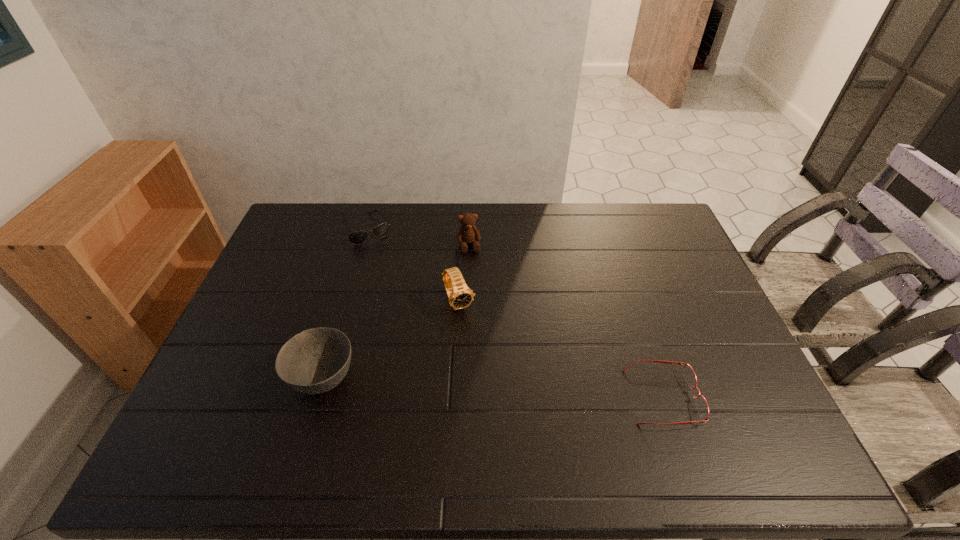
Find the location of `free spot between the spectacles and the sunglasses`. free spot between the spectacles and the sunglasses is located at coordinates (515, 313).

At what (x,y) coordinates should I click in order to perform the action: click on free area in between the rightmost object and the bowl. Please return your answer as a coordinate pair (x, y). Image resolution: width=960 pixels, height=540 pixels. Looking at the image, I should click on (493, 388).

At what (x,y) coordinates should I click in order to perform the action: click on vacant area that lies between the teddy bear and the bowl. Please return your answer as a coordinate pair (x, y). Looking at the image, I should click on (396, 312).

Locate an element on the screen. The image size is (960, 540). free space between the sunglasses and the watch is located at coordinates (413, 266).

At what (x,y) coordinates should I click in order to perform the action: click on empty space between the watch and the bowl. Please return your answer as a coordinate pair (x, y). Image resolution: width=960 pixels, height=540 pixels. Looking at the image, I should click on (392, 340).

The image size is (960, 540). Find the location of `empty space that is in between the third nearest object and the sunglasses`. empty space that is in between the third nearest object and the sunglasses is located at coordinates (413, 266).

What are the coordinates of `free space between the sunglasses and the rightmost object` in the screenshot? It's located at (515, 313).

Find the location of a particular element. free space between the spectacles and the bowl is located at coordinates (493, 388).

Point out which object is positioned as the nearest to the third farthest object. Please provide its 2D coordinates. Your answer should be formatted as a tuple, i.e. [(x, y)], where the tuple contains the x and y coordinates of a point satisfying the conditions above.

[(468, 233)]

Find the location of a particular element. The height and width of the screenshot is (540, 960). object that is the third closest to the third farthest object is located at coordinates (356, 238).